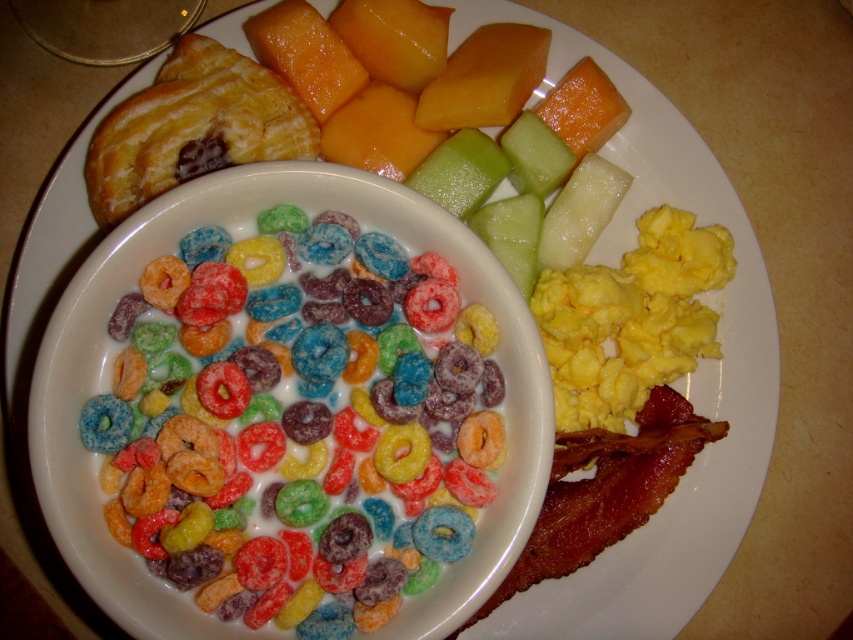
Question: Which point is farther to the camera?

Choices:
 (A) yellow/yellowish matte/scaly scrambled eggs at center-right
 (B) crispy brown bacon at lower right

Answer: (A)

Question: Which point is farther from the camera taking this photo?

Choices:
 (A) (664, 472)
 (B) (675, 294)

Answer: (B)

Question: From the image, what is the correct spatial relationship of yellow/yellowish matte/scaly scrambled eggs at center-right in relation to crispy brown bacon at lower right?

Choices:
 (A) above
 (B) below

Answer: (A)

Question: Can you confirm if colorful coated cereal at center is positioned above crispy brown bacon at lower right?

Choices:
 (A) yes
 (B) no

Answer: (A)

Question: Can you confirm if colorful coated cereal at center is wider than yellow/yellowish matte/scaly scrambled eggs at center-right?

Choices:
 (A) yes
 (B) no

Answer: (A)

Question: Which is farther from the crispy brown bacon at lower right?

Choices:
 (A) yellow/yellowish matte/scaly scrambled eggs at center-right
 (B) colorful coated cereal at center

Answer: (B)